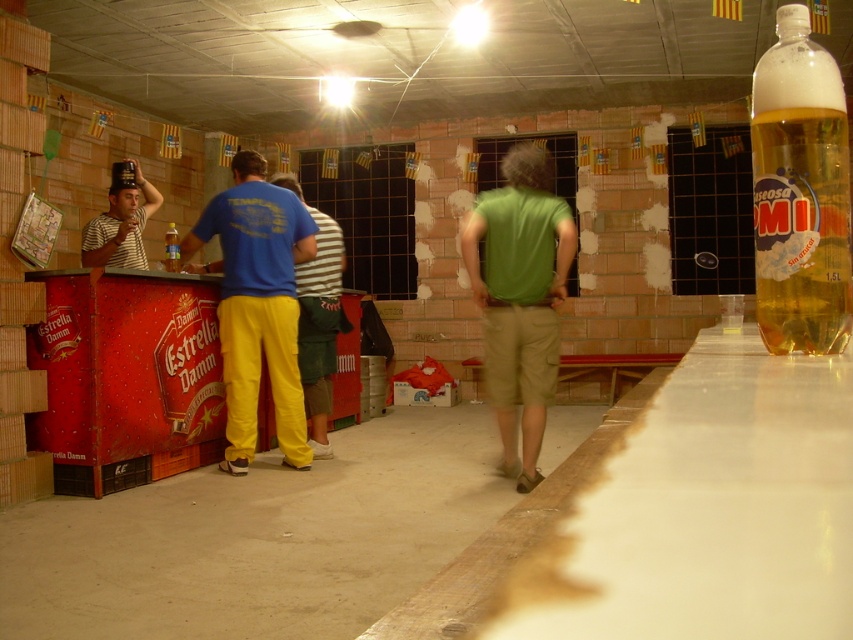
Who is shorter, translucent plastic bottle of beer at upper right or green matte shirt at center?

translucent plastic bottle of beer at upper right

Image resolution: width=853 pixels, height=640 pixels. I want to click on translucent plastic bottle of beer at upper right, so click(x=799, y=193).

The height and width of the screenshot is (640, 853). What are the coordinates of `translucent plastic bottle of beer at upper right` in the screenshot? It's located at (799, 193).

What are the coordinates of `translucent plastic bottle of beer at upper right` in the screenshot? It's located at [799, 193].

Is green matte shirt at center positioned at the back of translucent yellow bottle at center?

No, green matte shirt at center is closer to the viewer.

Does green matte shirt at center have a lesser width compared to translucent yellow bottle at center?

No.

Locate an element on the screen. The image size is (853, 640). green matte shirt at center is located at coordinates (520, 298).

Which of these two, yellow cotton pants at center or striped fabric hat at left, stands taller?

yellow cotton pants at center

Does yellow cotton pants at center have a lesser height compared to striped fabric hat at left?

Incorrect, yellow cotton pants at center's height does not fall short of striped fabric hat at left's.

Who is more distant from viewer, (326, 438) or (96, 266)?

The point (326, 438) is more distant.

The image size is (853, 640). I want to click on yellow cotton pants at center, so click(x=318, y=317).